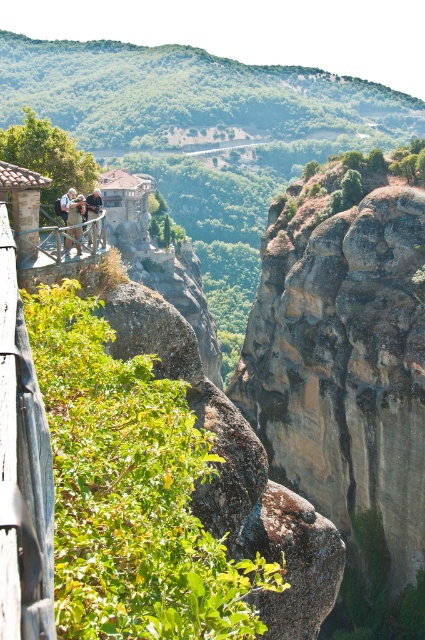
You are a hiker standing at the wooden at left. You want to reach the brown rough rock at center. Is the rock located above or below your current position?

The brown rough rock at center is below the wooden at left, so the rock is located below your current position.

You are a tour guide leading a group to the monastery. You need to ensure your group can safely walk from the wooden at left to the light brown leather jacket at upper center. The path is narrow and has a width of 1.5 meters. If your group is 2 meters wide, can they pass through this path?

The distance between wooden at left and light brown leather jacket at upper center is 5.99 meters. The path width is 1.5 meters, which is narrower than the group width of 2 meters. Therefore, the group cannot pass through the path safely.

You are standing at the viewing platform and want to take a photo of the light brown leather jacket at upper center and the light brown wooden railing at upper left. Which object should you focus on first to ensure both are in focus?

You should focus on the light brown wooden railing at upper left first because it is farther away from the viewer than the light brown leather jacket at upper center, so adjusting focus starting from the distant object ensures both are in focus.